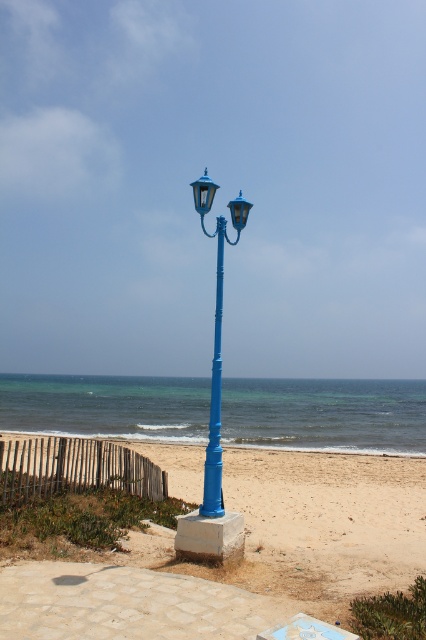
You are standing at the wooden fence to the left of the lamppost. You want to walk directly towards the point marked by the coordinates point (245, 556), which is the smooth sand at center. Will you have to cross the lamppost to reach that point?

The point marked by the coordinates point (245, 556) is located at the smooth sand at center. Since the lamppost is positioned to the right of the wooden fence, you would not need to cross the lamppost to reach the smooth sand at center. You can walk towards the center of the beach directly from the wooden fence without obstruction.

You are a beachgoer with a 10 meter long rope. You want to secure your belongings on the smooth sand at center using the blue painted metal pole at center as an anchor. Will your rope be long enough to reach from the pole to the sand?

The distance between the smooth sand at center and the blue painted metal pole at center is 9.84 meters. Since your rope is 10 meters long, it will be long enough to reach from the pole to the sand.